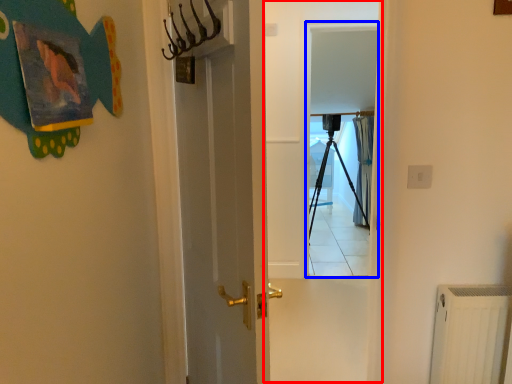
Question: Among these objects, which one is farthest to the camera, screen door (highlighted by a red box) or screen door (highlighted by a blue box)?

Choices:
 (A) screen door
 (B) screen door

Answer: (B)